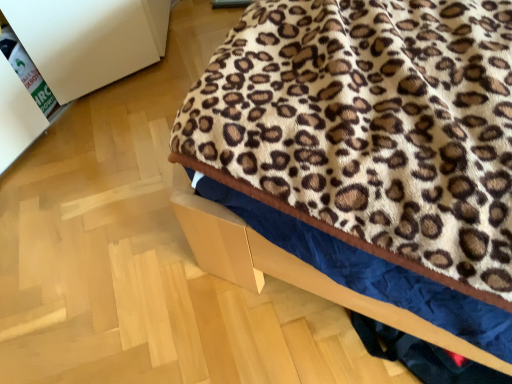
The height and width of the screenshot is (384, 512). In order to click on leopard print fabric at upper right in this screenshot , I will do `click(371, 152)`.

The width and height of the screenshot is (512, 384). What do you see at coordinates (371, 152) in the screenshot?
I see `leopard print fabric at upper right` at bounding box center [371, 152].

Where is `leopard print fabric at upper right`? leopard print fabric at upper right is located at coordinates tap(371, 152).